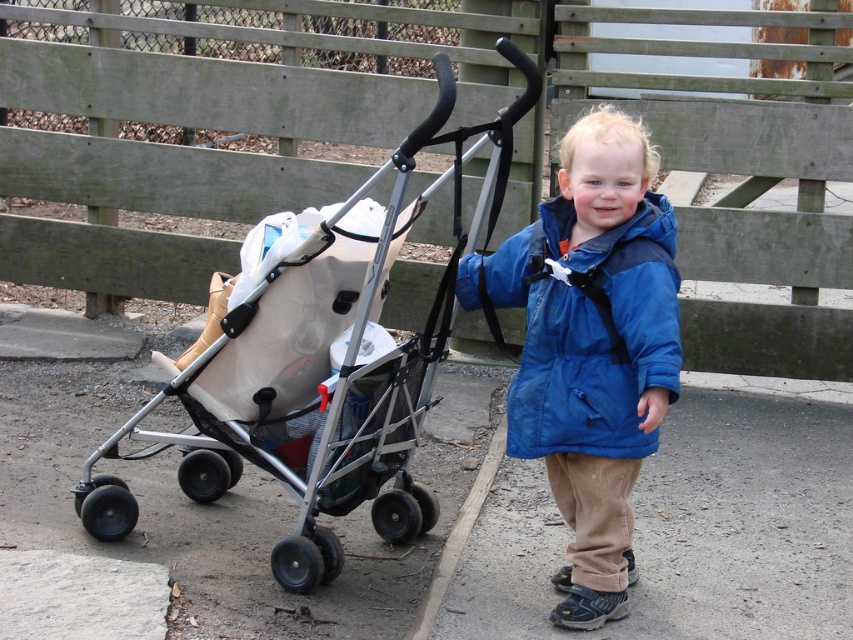
Question: Which point is closer to the camera taking this photo?

Choices:
 (A) (280, 284)
 (B) (643, 214)

Answer: (B)

Question: Where is silver metallic stroller at left located in relation to brown asphalt at lower right in the image?

Choices:
 (A) below
 (B) above

Answer: (B)

Question: Does silver metallic stroller at left appear on the right side of blue matte jacket at center?

Choices:
 (A) no
 (B) yes

Answer: (A)

Question: Among these points, which one is nearest to the camera?

Choices:
 (A) (769, 456)
 (B) (543, 419)

Answer: (B)

Question: Which is nearer to the silver metallic stroller at left?

Choices:
 (A) blue matte jacket at center
 (B) brown asphalt at lower right

Answer: (A)

Question: Can you confirm if silver metallic stroller at left is wider than brown asphalt at lower right?

Choices:
 (A) yes
 (B) no

Answer: (B)